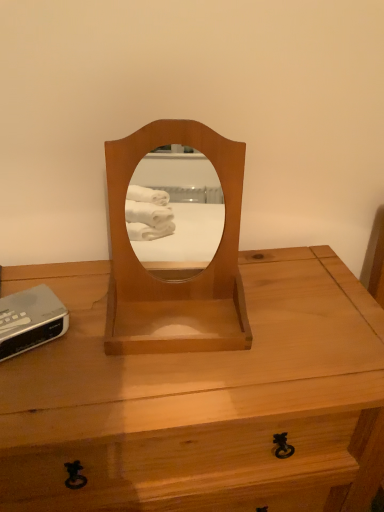
This screenshot has width=384, height=512. I want to click on spots to the right of light brown wood mirror at center, so click(286, 328).